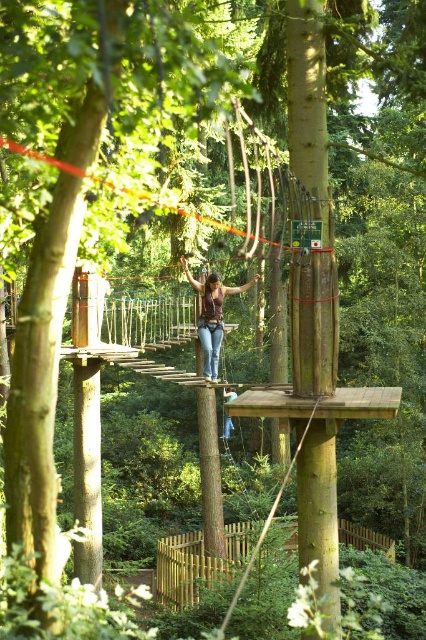
Is brown wooden fence at lower center smaller than denim jeans at center?

Correct, brown wooden fence at lower center occupies less space than denim jeans at center.

Which of these two, brown wooden fence at lower center or denim jeans at center, stands taller?

denim jeans at center

Identify the location of brown wooden fence at lower center. (198, 563).

Identify the location of brown wooden fence at lower center. This screenshot has height=640, width=426. (198, 563).

Between orange rope bridge at center and matte brown hair at center, which one has more height?

matte brown hair at center is taller.

Can you confirm if orange rope bridge at center is bigger than matte brown hair at center?

Correct, orange rope bridge at center is larger in size than matte brown hair at center.

Between point (2, 145) and point (224, 436), which one is positioned in front?

Positioned in front is point (2, 145).

Locate an element on the screen. The height and width of the screenshot is (640, 426). orange rope bridge at center is located at coordinates (135, 193).

Which is above, brown wooden fence at lower center or matte brown hair at center?

matte brown hair at center is higher up.

Can you confirm if brown wooden fence at lower center is thinner than matte brown hair at center?

In fact, brown wooden fence at lower center might be wider than matte brown hair at center.

Identify the location of brown wooden fence at lower center. (198, 563).